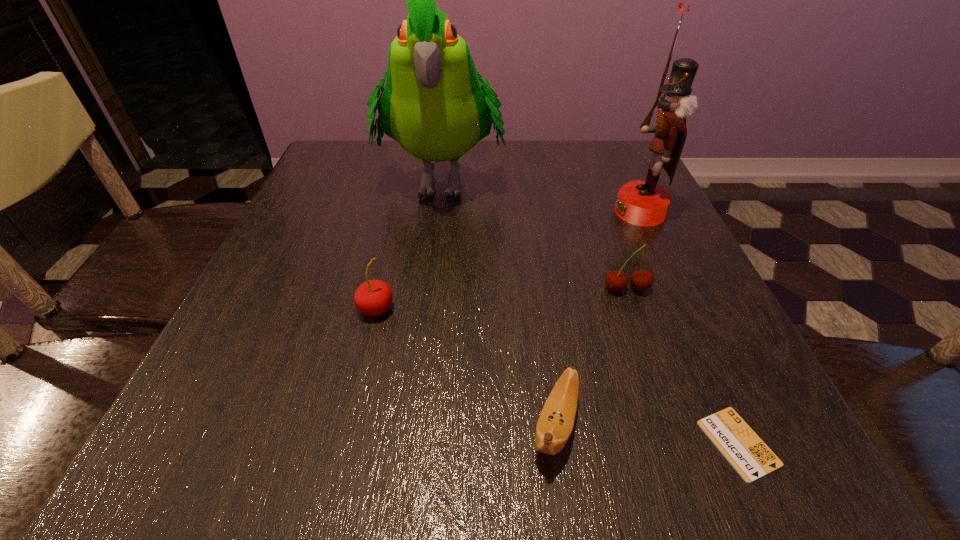
The width and height of the screenshot is (960, 540). Identify the location of free space between the right cherry and the identity card. (683, 366).

This screenshot has width=960, height=540. I want to click on free point between the parakeet and the shortest object, so click(590, 311).

Where is `vacant space in between the right cherry and the banana`? Image resolution: width=960 pixels, height=540 pixels. vacant space in between the right cherry and the banana is located at coordinates (591, 357).

This screenshot has width=960, height=540. Find the location of `empty location between the shortest object and the fifth tallest object`. empty location between the shortest object and the fifth tallest object is located at coordinates (647, 434).

Identify the location of free space between the nutcracker and the left cherry. (508, 260).

Find the location of a particular element. The image size is (960, 540). free space between the nutcracker and the parakeet is located at coordinates coord(540,195).

Image resolution: width=960 pixels, height=540 pixels. What are the coordinates of `empty space that is in between the left cherry and the shortest object` in the screenshot? It's located at (557, 376).

Identify the location of free spot between the nutcracker and the left cherry. This screenshot has height=540, width=960. (508, 260).

The height and width of the screenshot is (540, 960). Find the location of `object that stands as the closest to the nutcracker`. object that stands as the closest to the nutcracker is located at coordinates (616, 281).

At what (x,y) coordinates should I click in order to perform the action: click on the fourth closest object to the third object from left to right. Please return your answer as a coordinate pair (x, y). The image size is (960, 540). Looking at the image, I should click on (433, 104).